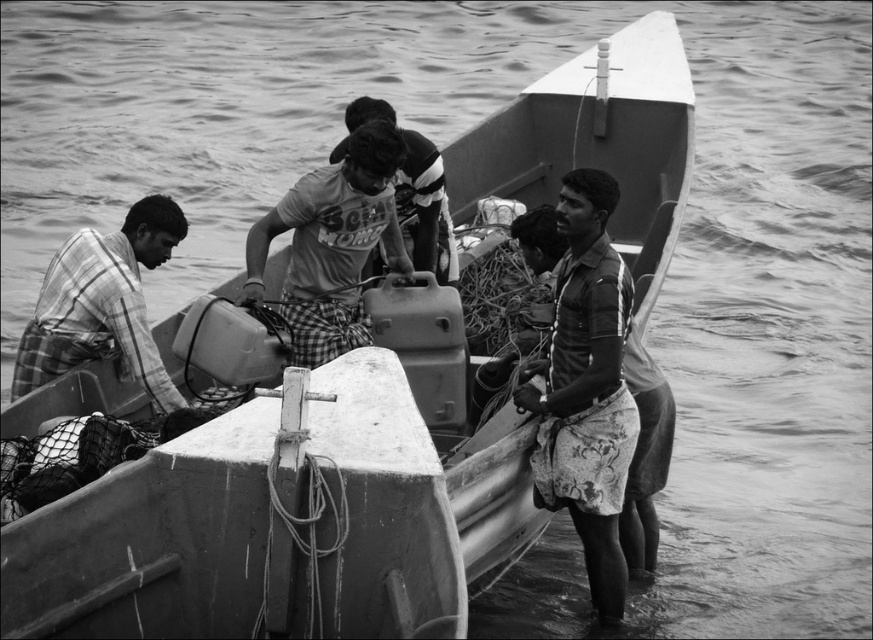
Which of these two, checkered fabric shirt at center or checkered fabric shirt at left, stands shorter?

With less height is checkered fabric shirt at left.

Who is more forward, (352,189) or (136,321)?

Point (136,321) is more forward.

The height and width of the screenshot is (640, 873). In order to click on checkered fabric shirt at center in this screenshot , I will do `click(332, 244)`.

Can you confirm if checkered fabric shirt at center is positioned to the right of dark fabric sarong at lower right?

No, checkered fabric shirt at center is not to the right of dark fabric sarong at lower right.

Does checkered fabric shirt at center lie in front of dark fabric sarong at lower right?

No.

In order to click on checkered fabric shirt at center in this screenshot , I will do `click(332, 244)`.

The height and width of the screenshot is (640, 873). I want to click on dark fabric sarong at lower right, so click(645, 456).

Is point (555, 262) farther from viewer compared to point (353, 106)?

No, it is not.

Where is `dark fabric sarong at lower right`? This screenshot has width=873, height=640. dark fabric sarong at lower right is located at coordinates [645, 456].